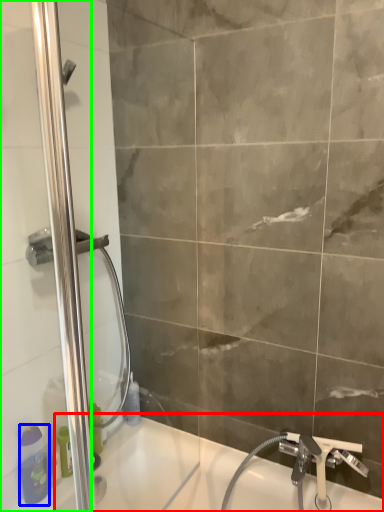
Question: Which is farther away from bath (highlighted by a red box)? toiletry (highlighted by a blue box) or screen door (highlighted by a green box)?

Choices:
 (A) toiletry
 (B) screen door

Answer: (B)